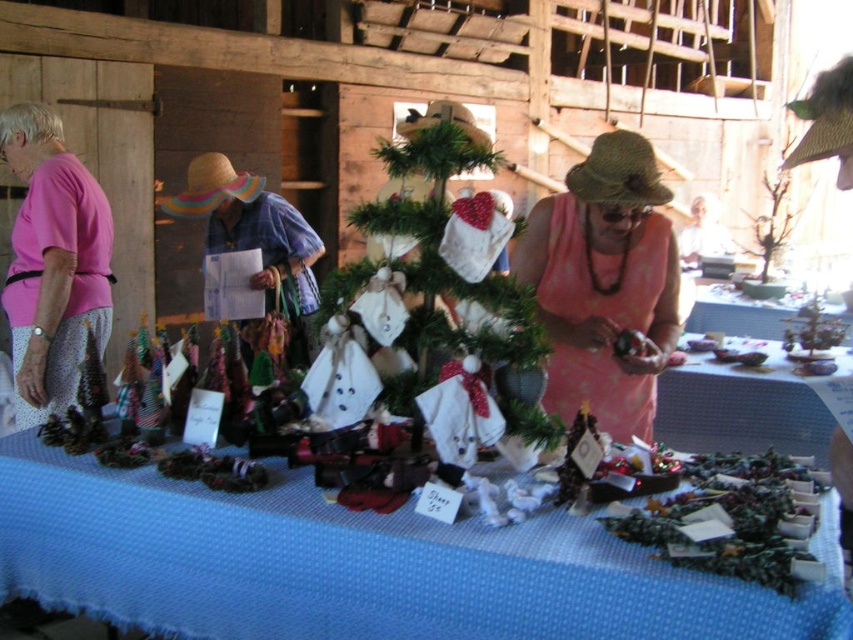
Does pink fabric dress at center appear on the right side of metallic silver tray at center?

No, pink fabric dress at center is not to the right of metallic silver tray at center.

Between pink fabric dress at center and metallic silver tray at center, which one has less height?

metallic silver tray at center is shorter.

Find the location of `pink fabric dress at center`. pink fabric dress at center is located at coordinates (604, 284).

Who is more forward, (578, 371) or (109, 288)?

Point (578, 371) is in front.

Does pink fabric dress at center have a lesser width compared to pink fabric shirt at left?

Incorrect, pink fabric dress at center's width is not less than pink fabric shirt at left's.

Is point (584, 344) less distant than point (45, 413)?

Yes, it is.

Locate an element on the screen. pink fabric dress at center is located at coordinates (604, 284).

Is point (16, 406) more distant than point (751, 333)?

No, (16, 406) is in front of (751, 333).

Is pink fabric shirt at left below metallic silver tray at center?

Actually, pink fabric shirt at left is above metallic silver tray at center.

This screenshot has height=640, width=853. I want to click on pink fabric shirt at left, so click(53, 264).

Image resolution: width=853 pixels, height=640 pixels. In order to click on pink fabric shirt at left in this screenshot , I will do `click(53, 264)`.